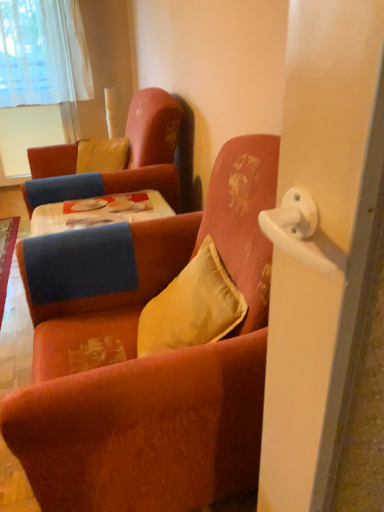
Question: Does velvet orange armchair at center, the second chair positioned from the back, have a larger size compared to satin yellow pillow at center, the first pillow from the front?

Choices:
 (A) no
 (B) yes

Answer: (B)

Question: Is velvet orange armchair at center, which is the first chair from front to back, aimed at satin yellow pillow at center, the first pillow from the front?

Choices:
 (A) no
 (B) yes

Answer: (B)

Question: Does velvet orange armchair at center, the second chair positioned from the back, have a lesser height compared to satin yellow pillow at center, which ranks as the first pillow in right-to-left order?

Choices:
 (A) yes
 (B) no

Answer: (B)

Question: Can you confirm if velvet orange armchair at center, which is the first chair from front to back, is positioned to the right of satin yellow pillow at center, which ranks as the first pillow in right-to-left order?

Choices:
 (A) no
 (B) yes

Answer: (A)

Question: From the image's perspective, does velvet orange armchair at center, which is the first chair from front to back, appear higher than satin yellow pillow at center, which ranks as the first pillow in right-to-left order?

Choices:
 (A) no
 (B) yes

Answer: (A)

Question: Considering the relative positions of velvet orange armchair at center, which is the first chair from front to back, and satin yellow pillow at center, the first pillow from the front, in the image provided, is velvet orange armchair at center, which is the first chair from front to back, to the left of satin yellow pillow at center, the first pillow from the front, from the viewer's perspective?

Choices:
 (A) yes
 (B) no

Answer: (A)

Question: Is velvet orange armchair at center, the second chair positioned from the back, outside of velvet orange armchair at upper left, positioned as the first chair in back-to-front order?

Choices:
 (A) yes
 (B) no

Answer: (A)

Question: Does velvet orange armchair at center, which is the first chair from front to back, appear on the right side of velvet orange armchair at upper left, positioned as the first chair in back-to-front order?

Choices:
 (A) yes
 (B) no

Answer: (A)

Question: Can you confirm if velvet orange armchair at center, which is the first chair from front to back, is smaller than velvet orange armchair at upper left, positioned as the first chair in back-to-front order?

Choices:
 (A) no
 (B) yes

Answer: (A)

Question: Considering the relative sizes of velvet orange armchair at center, the second chair positioned from the back, and velvet orange armchair at upper left, positioned as the first chair in back-to-front order, in the image provided, is velvet orange armchair at center, the second chair positioned from the back, taller than velvet orange armchair at upper left, positioned as the first chair in back-to-front order,?

Choices:
 (A) no
 (B) yes

Answer: (B)

Question: From a real-world perspective, is velvet orange armchair at center, which is the first chair from front to back, over velvet orange armchair at upper left, the 2th chair in the front-to-back sequence?

Choices:
 (A) yes
 (B) no

Answer: (B)

Question: Can you confirm if velvet orange armchair at center, which is the first chair from front to back, is wider than velvet orange armchair at upper left, positioned as the first chair in back-to-front order?

Choices:
 (A) no
 (B) yes

Answer: (B)

Question: From a real-world perspective, does yellow velvet pillow at upper left, the 2th pillow positioned from the front, stand above velvet orange armchair at center, which is the first chair from front to back?

Choices:
 (A) yes
 (B) no

Answer: (A)